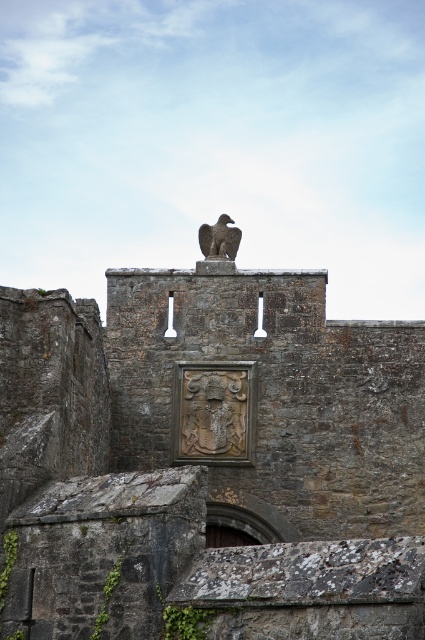
Question: Can you confirm if carved stone shield at center is positioned below rustic stone eagle at center?

Choices:
 (A) yes
 (B) no

Answer: (A)

Question: Which object is farther from the camera taking this photo?

Choices:
 (A) carved stone shield at center
 (B) stone eagle at center

Answer: (A)

Question: Does stone eagle at center appear on the left side of carved stone shield at center?

Choices:
 (A) no
 (B) yes

Answer: (B)

Question: Considering the real-world distances, which object is closest to the rustic stone eagle at center?

Choices:
 (A) carved stone shield at center
 (B) stone eagle at center

Answer: (A)

Question: Estimate the real-world distances between objects in this image. Which object is farther from the rustic stone eagle at center?

Choices:
 (A) stone eagle at center
 (B) carved stone shield at center

Answer: (A)

Question: Does carved stone shield at center appear over rustic stone eagle at center?

Choices:
 (A) yes
 (B) no

Answer: (B)